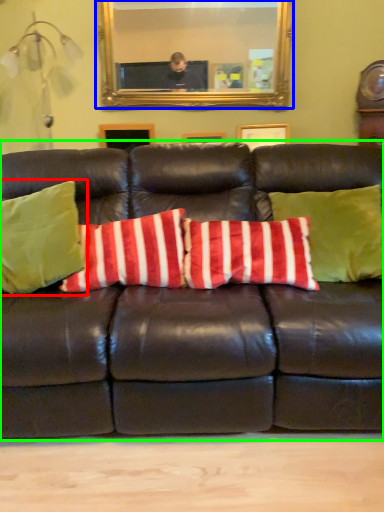
Question: Which is farther away from pillow (highlighted by a red box)? mirror (highlighted by a blue box) or studio couch (highlighted by a green box)?

Choices:
 (A) mirror
 (B) studio couch

Answer: (A)